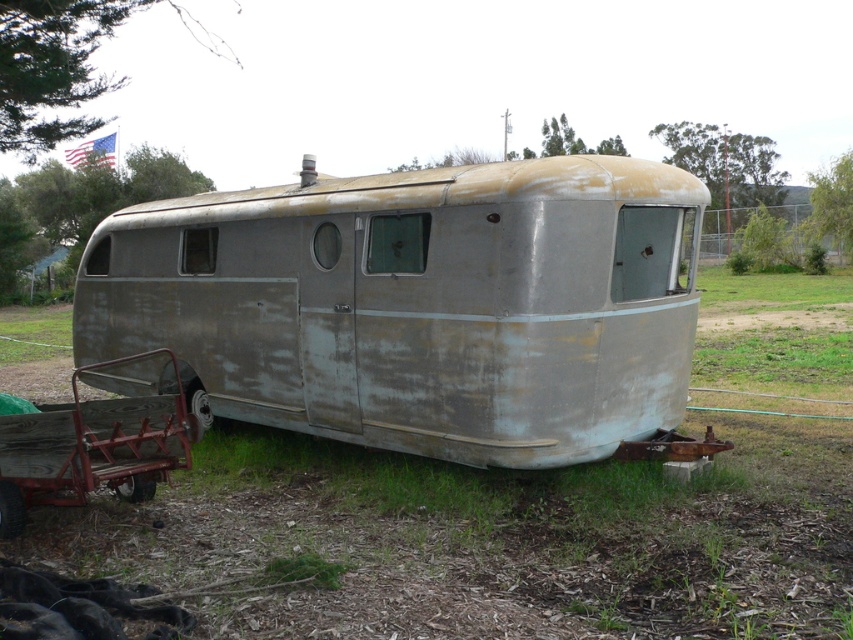
Question: Among these objects, which one is nearest to the camera?

Choices:
 (A) rusty metal trailer at center
 (B) rusty metal cart at lower left

Answer: (B)

Question: Observing the image, what is the correct spatial positioning of rusty metal trailer at center in reference to rusty metal cart at lower left?

Choices:
 (A) right
 (B) left

Answer: (A)

Question: Which point is closer to the camera?

Choices:
 (A) (112, 456)
 (B) (656, 259)

Answer: (A)

Question: Can you confirm if rusty metal trailer at center is smaller than rusty metal cart at lower left?

Choices:
 (A) yes
 (B) no

Answer: (B)

Question: Which point is closer to the camera?

Choices:
 (A) rusty metal trailer at center
 (B) rusty metal cart at lower left

Answer: (B)

Question: Can you confirm if rusty metal trailer at center is positioned above rusty metal cart at lower left?

Choices:
 (A) no
 (B) yes

Answer: (B)